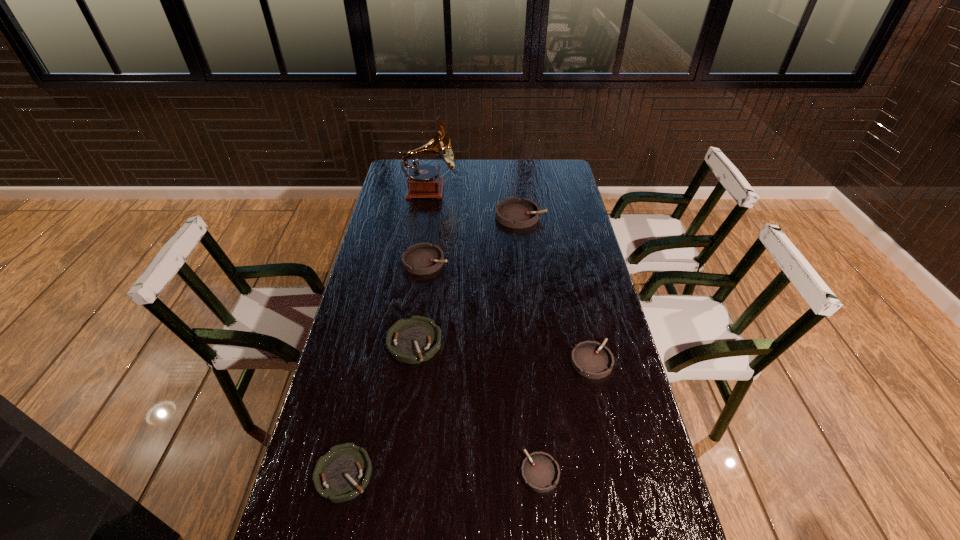
You are a GUI agent. You are given a task and a screenshot of the screen. Output one action in this format:
    pyautogui.click(x=<x>, y=<y>)
    Task: Click on the vacant region at the left edge of the desktop
    
    Given the screenshot: What is the action you would take?
    pyautogui.click(x=380, y=271)

Find the location of a particular element. The height and width of the screenshot is (540, 960). vacant region at the right edge of the desktop is located at coordinates (555, 274).

Where is `free point at the far left corner`? The image size is (960, 540). free point at the far left corner is located at coordinates (399, 159).

I want to click on free space at the far right corner of the desktop, so tap(541, 179).

In order to click on free spot between the tallest ashtray and the second nearest gray ashtray in this screenshot , I will do `click(556, 288)`.

The width and height of the screenshot is (960, 540). I want to click on free spot between the third nearest gray ashtray and the second nearest gray ashtray, so click(509, 311).

Locate an element on the screen. This screenshot has height=540, width=960. free space between the farther green ashtray and the third tallest object is located at coordinates 420,302.

The image size is (960, 540). I want to click on empty space between the farthest gray ashtray and the smallest gray ashtray, so click(x=530, y=344).

Identify the location of unoccupied position between the farther green ashtray and the leftmost gray ashtray. The height and width of the screenshot is (540, 960). (420, 302).

The width and height of the screenshot is (960, 540). I want to click on free spot between the nearer green ashtray and the nearest gray ashtray, so click(x=442, y=473).